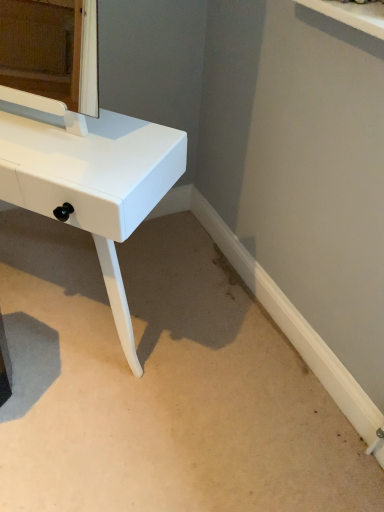
Image resolution: width=384 pixels, height=512 pixels. Find the location of `free spot below white glossy desk at upper left (from a real-world perspective)`. free spot below white glossy desk at upper left (from a real-world perspective) is located at coordinates (51, 318).